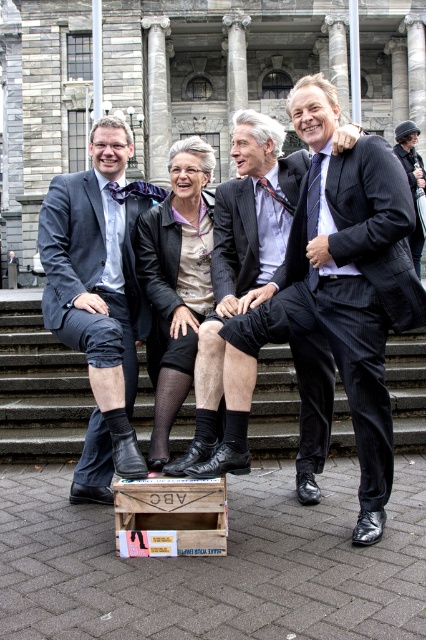
Between point (126, 474) and point (316, 192), which one is positioned behind?

Point (316, 192)

Who is higher up, dark blue suit at center or silk tie at right?

silk tie at right is higher up.

Where is `dark blue suit at center`? dark blue suit at center is located at coordinates (98, 298).

Identify the location of dark blue suit at center. (98, 298).

Does dark gray suit at center have a lesser width compared to dark blue suit at center?

No, dark gray suit at center is not thinner than dark blue suit at center.

Describe the element at coordinates (334, 304) in the screenshot. This screenshot has width=426, height=640. I see `dark gray suit at center` at that location.

In order to click on dark gray suit at center in this screenshot , I will do `click(334, 304)`.

Who is taller, matte black suit at center or wooden crate at lower center?

Standing taller between the two is matte black suit at center.

Which is below, matte black suit at center or wooden crate at lower center?

wooden crate at lower center is lower down.

Which is behind, point (198, 348) or point (221, 500)?

Point (198, 348)

Where is `matte black suit at center`? matte black suit at center is located at coordinates (241, 253).